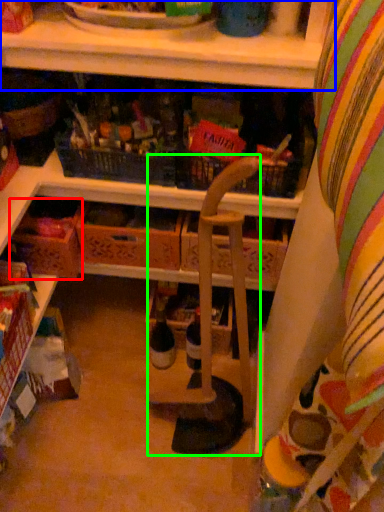
Question: Which object is positioned farthest from drawer (highlighted by a red box)? Select from shelf (highlighted by a blue box) and armchair (highlighted by a green box).

Choices:
 (A) shelf
 (B) armchair

Answer: (A)